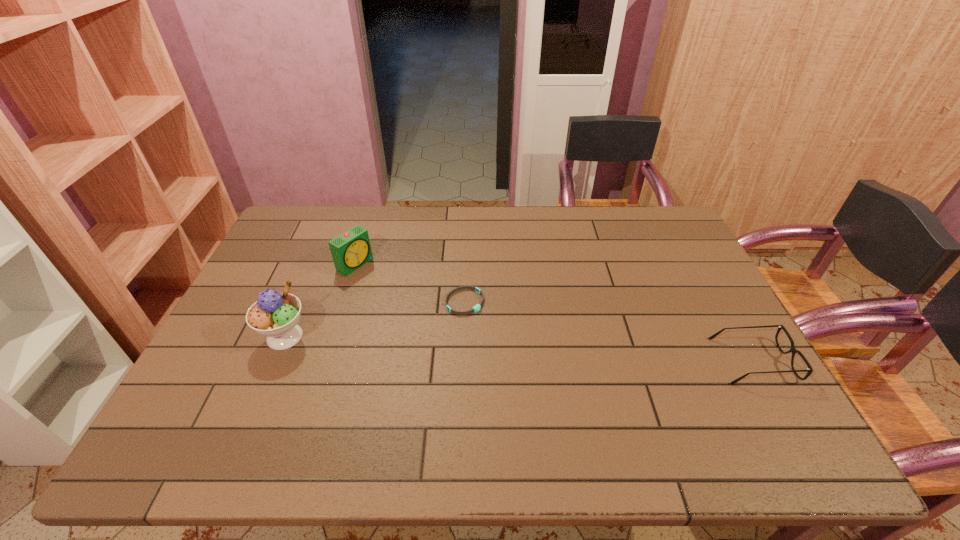
The width and height of the screenshot is (960, 540). I want to click on object present at the right edge, so click(793, 350).

You are a GUI agent. You are given a task and a screenshot of the screen. Output one action in this format:
    pyautogui.click(x=<x>, y=<y>)
    Task: Click on the object that is positioned at the near right corner
    This screenshot has height=540, width=960.
    Given the screenshot: What is the action you would take?
    pyautogui.click(x=793, y=350)

In the image, there is a desktop. Identify the location of vacant area at the far edge. (622, 240).

The height and width of the screenshot is (540, 960). In the image, there is a desktop. In order to click on vacant space at the near edge in this screenshot , I will do `click(677, 383)`.

Locate an element on the screen. free region at the left edge of the desktop is located at coordinates (287, 255).

The width and height of the screenshot is (960, 540). I want to click on vacant space at the right edge, so click(742, 382).

You are a GUI agent. You are given a task and a screenshot of the screen. Output one action in this format:
    pyautogui.click(x=<x>, y=<y>)
    Task: Click on the vacant space at the far left corner of the desktop
    
    Given the screenshot: What is the action you would take?
    pyautogui.click(x=332, y=208)

Locate an element on the screen. The height and width of the screenshot is (540, 960). vacant space at the near left corner is located at coordinates (227, 396).

At what (x,y) coordinates should I click in order to perform the action: click on vacant area that lies between the icecream and the third object from left to right. Please return your answer as a coordinate pair (x, y). Looking at the image, I should click on (374, 319).

I want to click on free spot between the wristband and the icecream, so click(x=374, y=319).